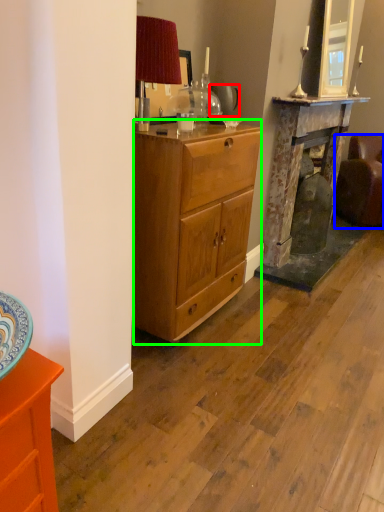
Question: Based on their relative distances, which object is nearer to teapot (highlighted by a red box)? Choose from studio couch (highlighted by a blue box) and desk (highlighted by a green box).

Choices:
 (A) studio couch
 (B) desk

Answer: (B)